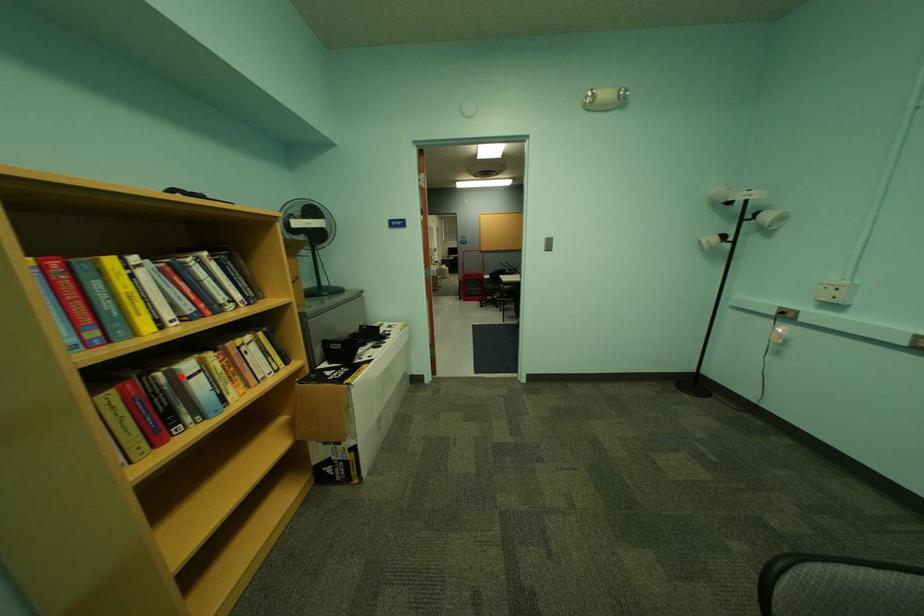
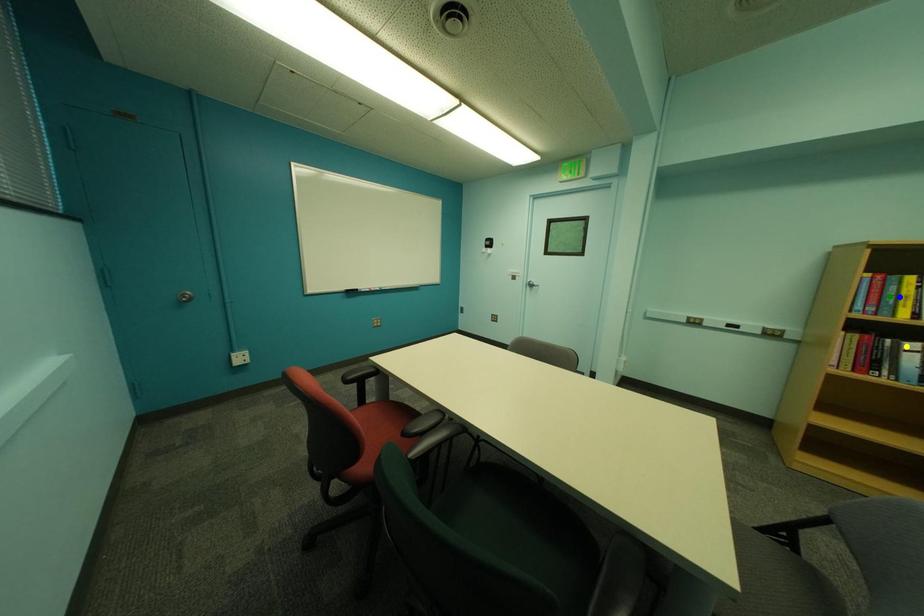
Question: I am providing you with two images of the same scene from different viewpoints. A red point is marked on the first image. You are given multiple points on the second image. In image 2, which mark is for the same physical point as the one in image 1?

Choices:
 (A) blue point
 (B) green point
 (C) yellow point

Answer: (C)